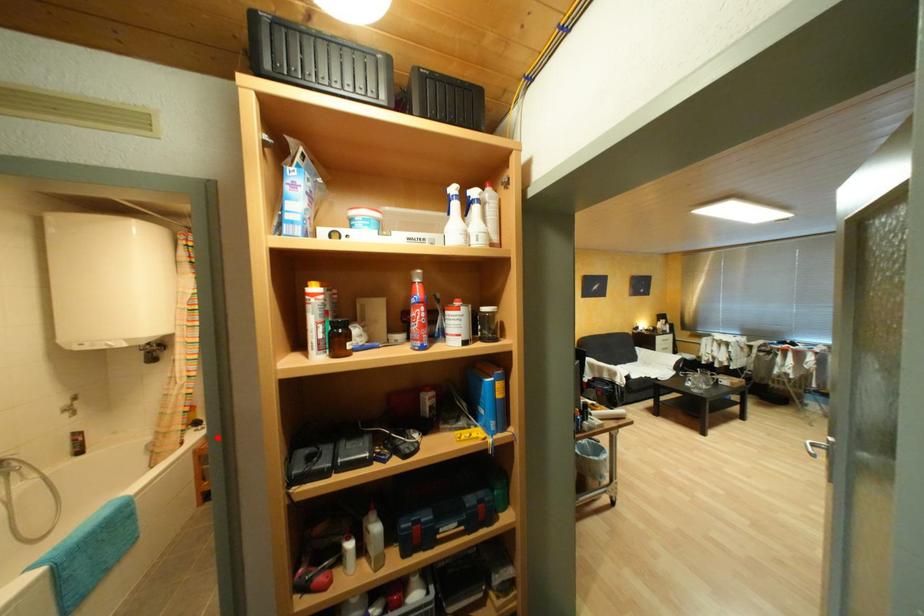
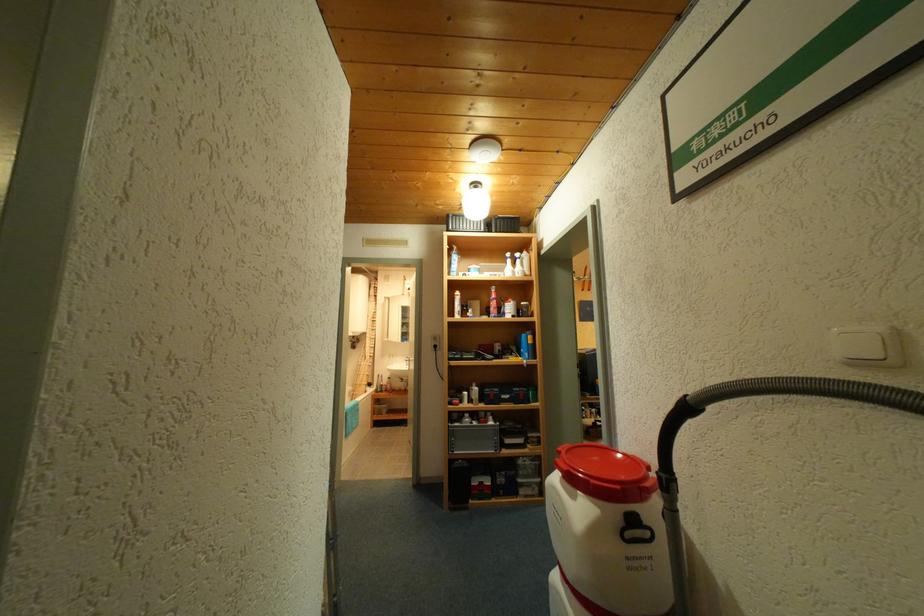
Question: I am providing you with two images of the same scene from different viewpoints. In image1, a red point is highlighted. Considering the same 3D point in image2, which of the following is correct?

Choices:
 (A) It is closer
 (B) It is farther

Answer: (A)